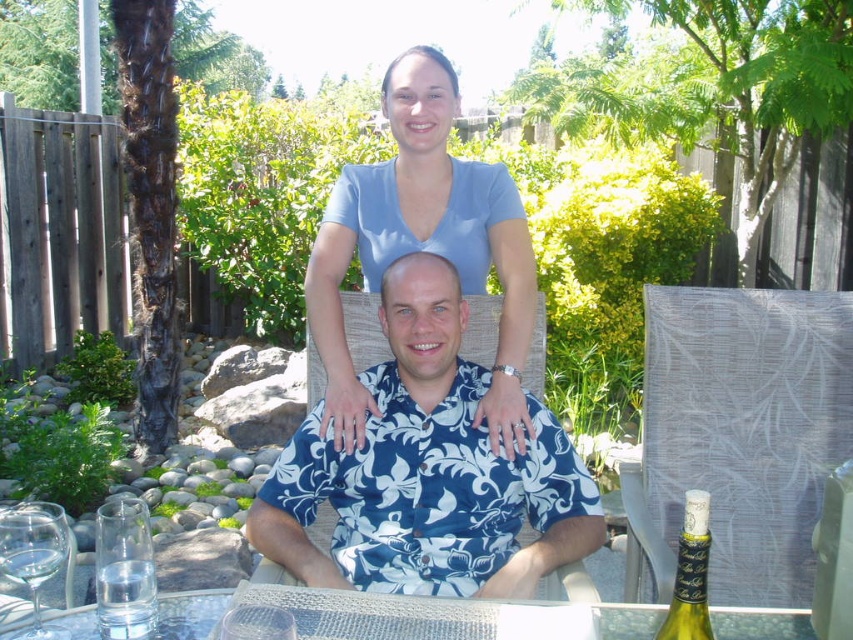
Question: Can you confirm if blue floral shirt at center is wider than green glass bottle at lower right?

Choices:
 (A) yes
 (B) no

Answer: (A)

Question: Which of the following is the farthest from the observer?

Choices:
 (A) gray fabric chair at right
 (B) light blue cotton shirt at upper center
 (C) blue floral shirt at center

Answer: (B)

Question: Which of the following is the closest to the observer?

Choices:
 (A) blue floral shirt at center
 (B) clear glass wine glass at lower left
 (C) clear glass water at lower left
 (D) clear glass at lower left

Answer: (B)

Question: Can you confirm if blue floral shirt at center is thinner than clear glass wine glass at lower left?

Choices:
 (A) yes
 (B) no

Answer: (B)

Question: Observing the image, what is the correct spatial positioning of gray fabric chair at right in reference to light blue cotton shirt at upper center?

Choices:
 (A) left
 (B) right

Answer: (B)

Question: Which of the following is the farthest from the observer?

Choices:
 (A) (129, 497)
 (B) (698, 595)

Answer: (A)